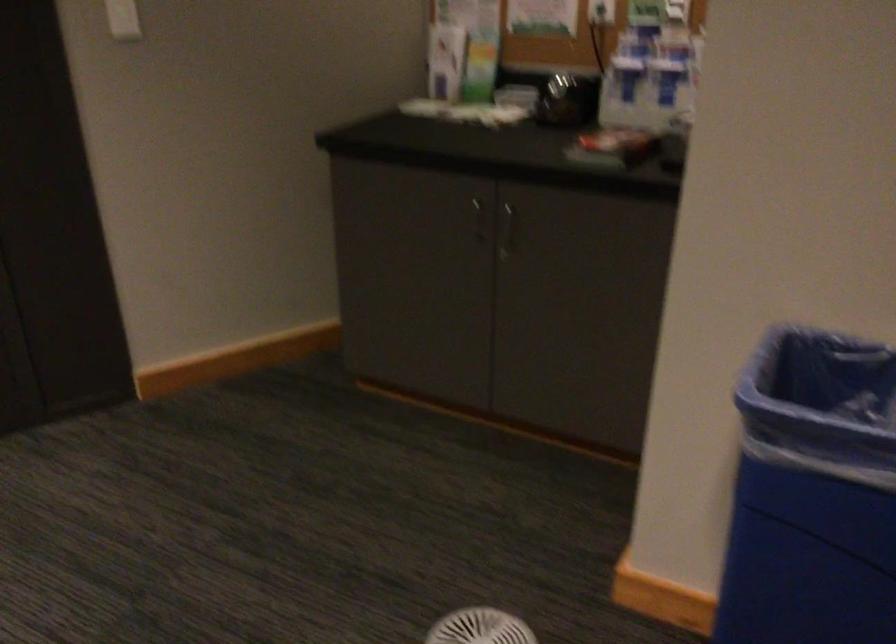
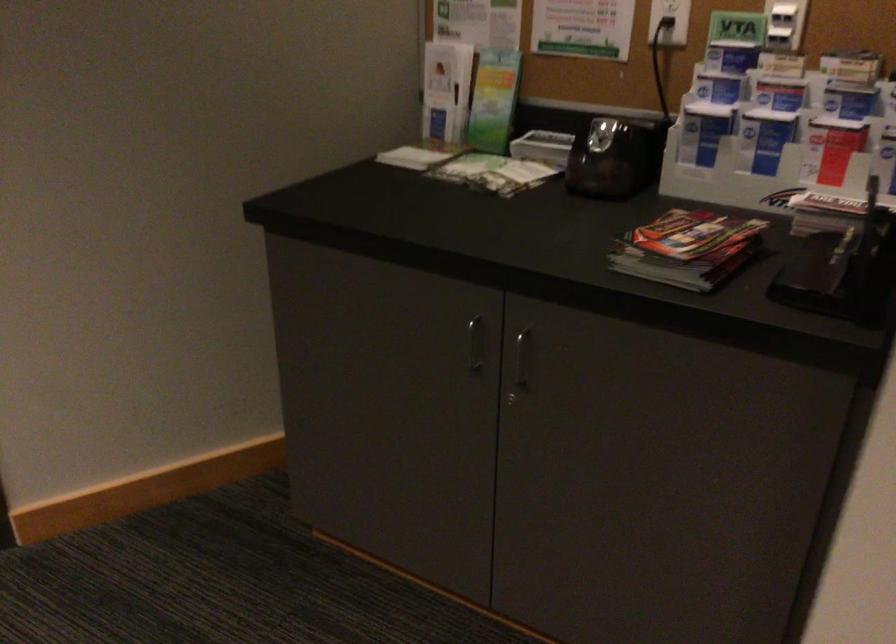
Find the pixel in the second image that matches (625,75) in the first image.

(702, 131)